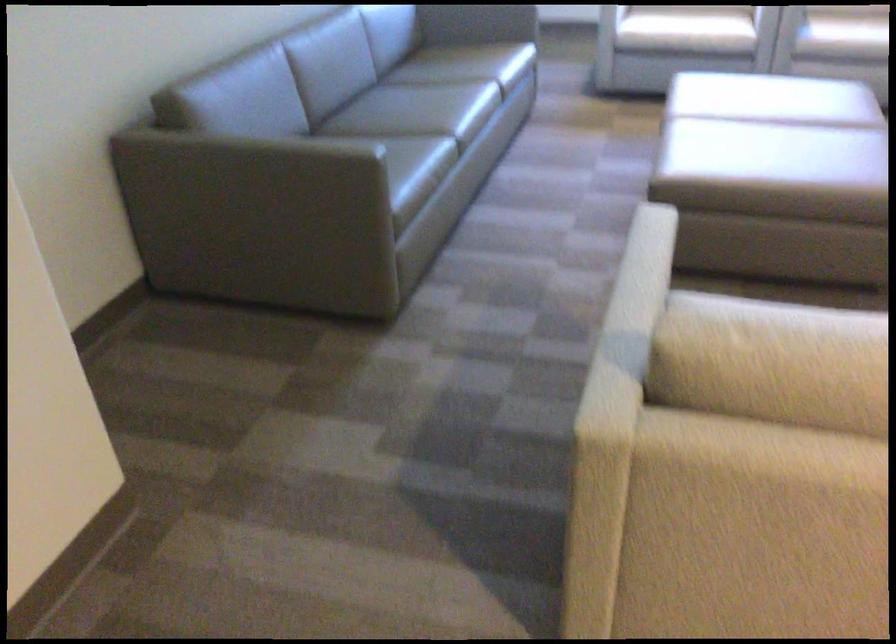
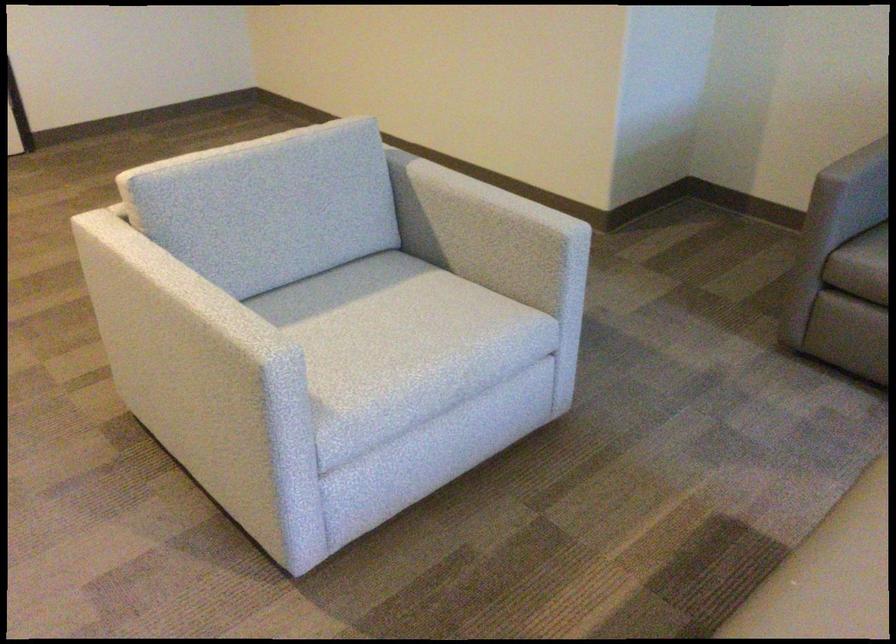
Where in the second image is the point corresponding to point (323, 149) from the first image?

(858, 164)